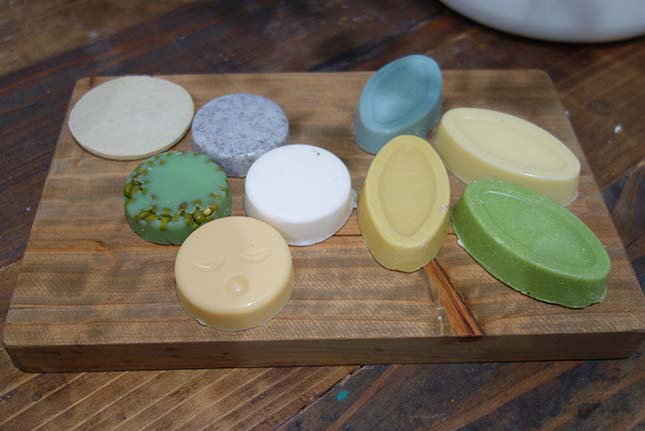
Find the location of `paint speck on table`. paint speck on table is located at coordinates (341, 388).